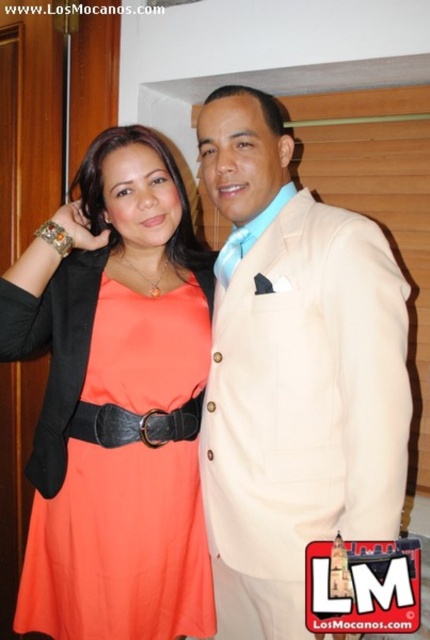
You are a photographer adjusting the focus of your camera. You want to ensure that both the beige fabric suit at center and the black leather belt at center are in sharp focus. Which object should you focus on first to achieve this?

You should focus on the beige fabric suit at center first since it is closer to the viewer than the black leather belt at center. By focusing on the closer object, the depth of field will extend backward, potentially keeping both in focus.

You are standing in the same room as the two people in the image. You want to move from the point at coordinate point (264, 493) to the point at coordinate point (70, 612). Which direction should you move to get closer to your destination?

To move from point (264, 493) to point (70, 612), you should move downward and to the right since point (264, 493) is in front of point (70, 612), indicating it is closer to the viewer and the destination is behind it.

You are a photographer adjusting the lighting for a photo shoot. You need to ensure that the beige fabric suit at center is evenly lit. Where should you place the main light source relative to the point marked at coordinates (294, 372)?

The point at coordinates (294, 372) marks the beige fabric suit at center, so the main light source should be placed directly in front of this point to ensure even lighting across the fabric.